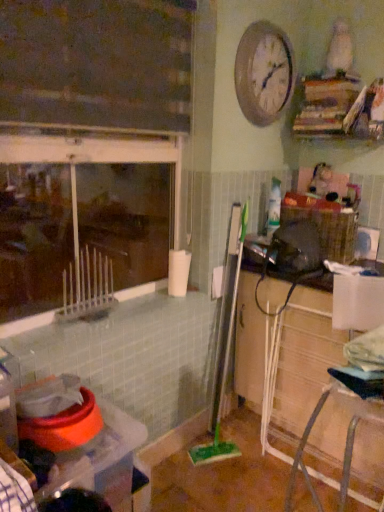
Question: From a real-world perspective, is metallic silver clock at upper center positioned above or below woven brown basket at right?

Choices:
 (A) below
 (B) above

Answer: (B)

Question: Is metallic silver clock at upper center in front of or behind woven brown basket at right in the image?

Choices:
 (A) behind
 (B) front

Answer: (B)

Question: Which object is positioned closest to the metallic silver clock at upper center?

Choices:
 (A) plastic container at lower left
 (B) woven brown basket at right
 (C) wooden cabinet at lower right
 (D) green plastic brush at center

Answer: (B)

Question: Estimate the real-world distances between objects in this image. Which object is farther from the wooden cabinet at lower right?

Choices:
 (A) woven brown basket at right
 (B) metallic silver clock at upper center
 (C) green plastic brush at center
 (D) plastic container at lower left

Answer: (B)